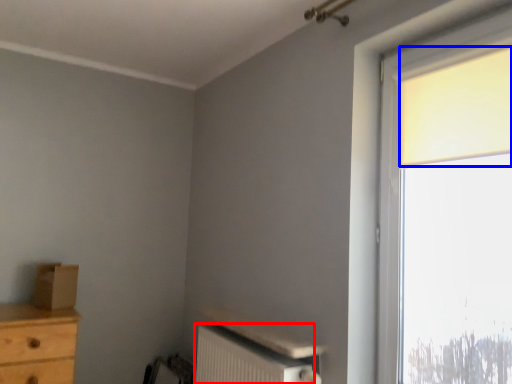
Question: Which of the following is the closest to the observer, radiator (highlighted by a red box) or curtain (highlighted by a blue box)?

Choices:
 (A) radiator
 (B) curtain

Answer: (B)